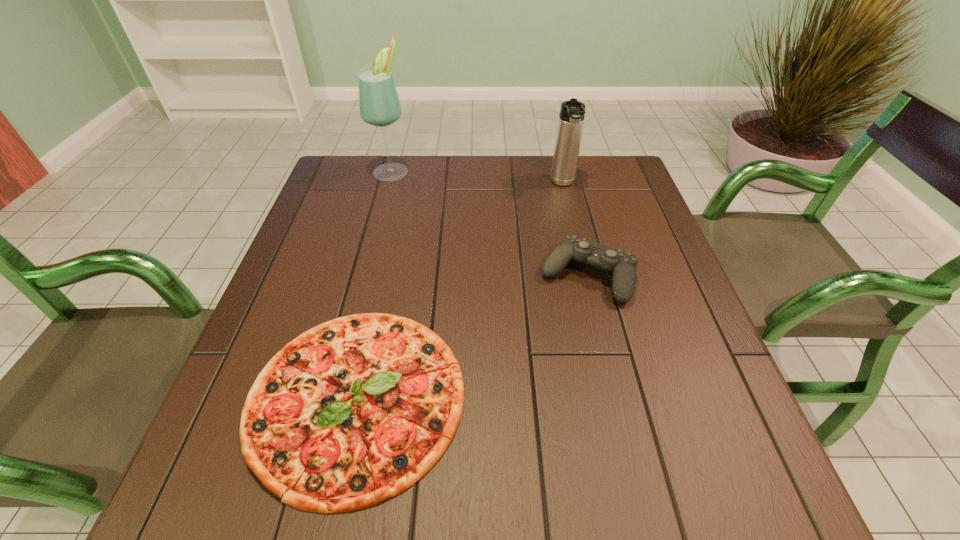
This screenshot has width=960, height=540. Find the location of `the tallest object`. the tallest object is located at coordinates (379, 105).

The image size is (960, 540). What are the coordinates of `thermos bottle` in the screenshot? It's located at (571, 117).

The image size is (960, 540). Find the location of `control`. control is located at coordinates (622, 265).

At what (x,y) coordinates should I click in order to perform the action: click on the second shortest object. Please return your answer as a coordinate pair (x, y). This screenshot has height=540, width=960. Looking at the image, I should click on (622, 265).

Locate an element on the screen. The width and height of the screenshot is (960, 540). pizza is located at coordinates (352, 412).

Identify the location of the nearest object. (352, 412).

Locate an element on the screen. This screenshot has height=540, width=960. vacant space located on the right of the tallest object is located at coordinates (469, 171).

Identify the location of free region located on the handle side of the third shortest object. The height and width of the screenshot is (540, 960). (583, 268).

This screenshot has height=540, width=960. I want to click on vacant space located 0.140m on the front of the control, so click(609, 364).

In order to click on free region located on the back of the nearest object in this screenshot , I will do `click(389, 248)`.